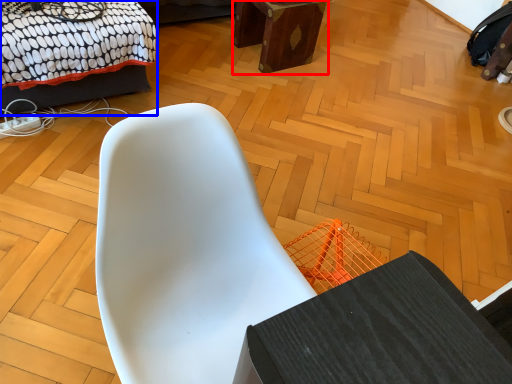
Question: Which object is closer to the camera taking this photo, furniture (highlighted by a red box) or bed (highlighted by a blue box)?

Choices:
 (A) furniture
 (B) bed

Answer: (B)